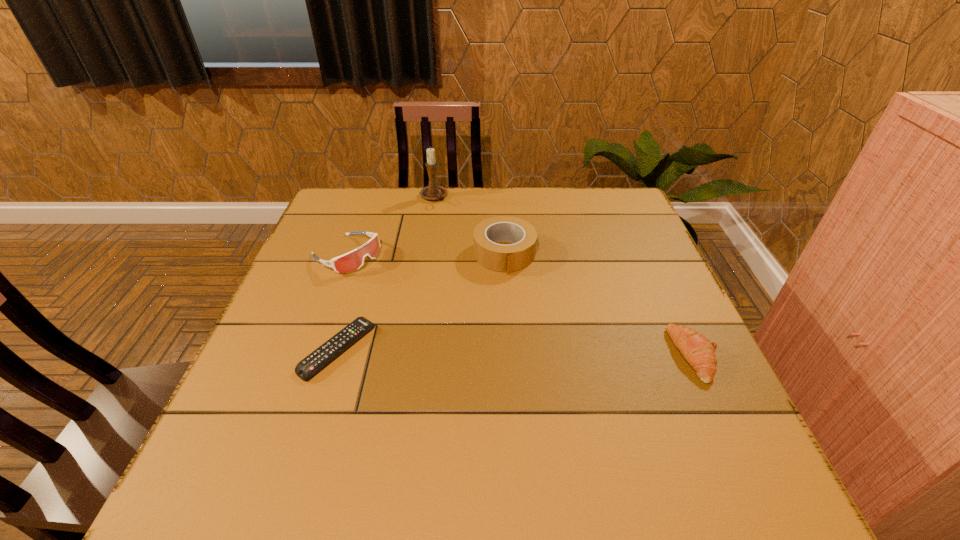
Where is `free spot located 0.260m at the edge of the second object from right to left`? The height and width of the screenshot is (540, 960). free spot located 0.260m at the edge of the second object from right to left is located at coordinates (530, 354).

I want to click on vacant space located 0.290m at the edge of the second object from right to left, so click(x=533, y=366).

Identify the location of vacant space located on the side of the tallest object with the handle. This screenshot has width=960, height=540. (463, 268).

Image resolution: width=960 pixels, height=540 pixels. In order to click on free space located on the side of the tallest object with the handle in this screenshot , I will do `click(441, 216)`.

Identify the location of vacant space located on the side of the tallest object with the handle. (463, 268).

You are a GUI agent. You are given a task and a screenshot of the screen. Output one action in this format:
    pyautogui.click(x=<x>, y=<y>)
    Task: Click on the free region located 0.070m on the front-facing side of the goggles
    
    Given the screenshot: What is the action you would take?
    pyautogui.click(x=387, y=279)

Find the location of a particular element. Image resolution: width=960 pixels, height=540 pixels. free space located 0.230m on the front-facing side of the goggles is located at coordinates (432, 307).

Identify the location of free space located on the front-facing side of the goggles. This screenshot has width=960, height=540. (451, 319).

Locate an element on the screen. The height and width of the screenshot is (540, 960). object that is at the far edge is located at coordinates click(x=433, y=192).

Where is `remote control situated at the left edge`? The height and width of the screenshot is (540, 960). remote control situated at the left edge is located at coordinates (305, 369).